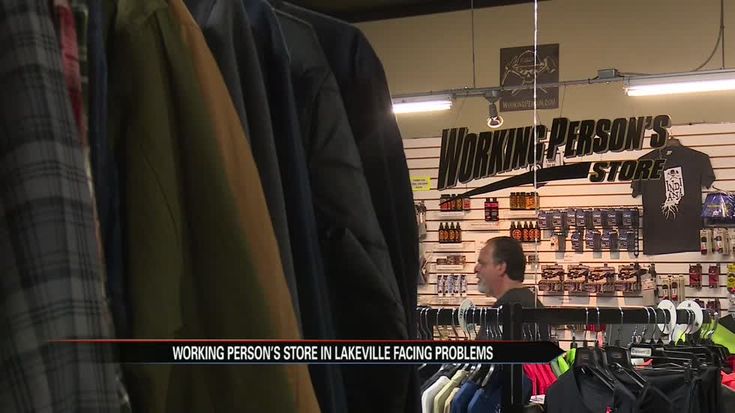
Where is `electrical lighting`? electrical lighting is located at coordinates (411, 99), (675, 87).